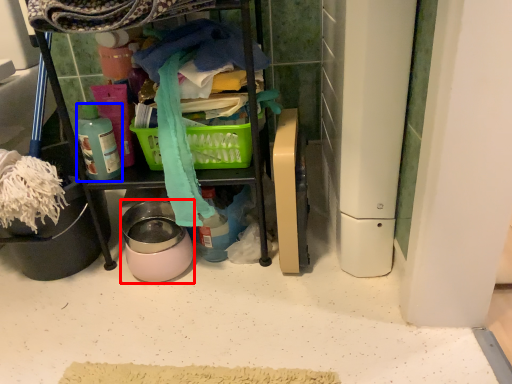
Question: Which of the following is the closest to the observer, appliance (highlighted by a red box) or bottle (highlighted by a blue box)?

Choices:
 (A) appliance
 (B) bottle

Answer: (B)